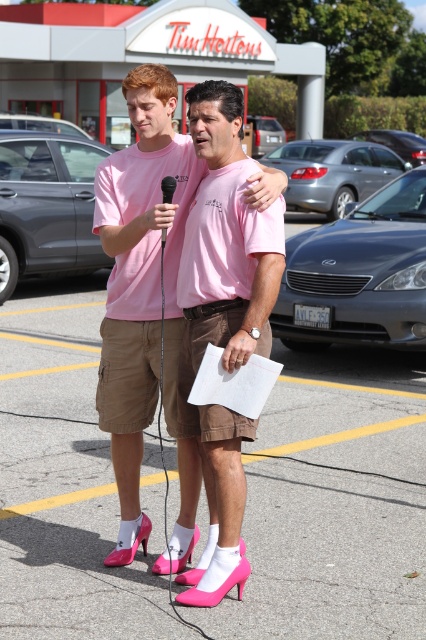
Question: Which point is farther to the camera?

Choices:
 (A) pink fabric shoes at center
 (B) black plastic microphone at center

Answer: (A)

Question: Is pink fabric shoes at center above black plastic microphone at center?

Choices:
 (A) yes
 (B) no

Answer: (B)

Question: Is pink fabric shoes at center bigger than black plastic microphone at center?

Choices:
 (A) no
 (B) yes

Answer: (B)

Question: Which object is farther from the camera taking this photo?

Choices:
 (A) pink fabric shoes at center
 (B) black plastic microphone at center

Answer: (A)

Question: Among these points, which one is farthest from the camera?

Choices:
 (A) (164, 193)
 (B) (146, 259)

Answer: (B)

Question: Can you confirm if pink fabric shoes at center is positioned above black plastic microphone at center?

Choices:
 (A) no
 (B) yes

Answer: (A)